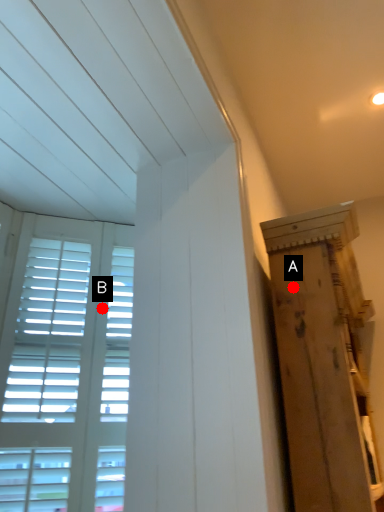
Question: Two points are circled on the image, labeled by A and B beside each circle. Which point is farther from the camera taking this photo?

Choices:
 (A) A is further
 (B) B is further

Answer: (B)